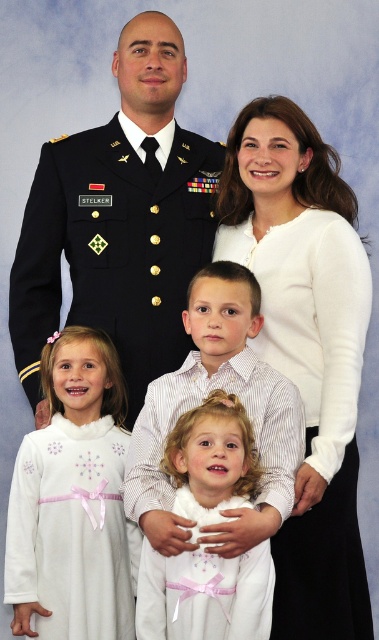
Question: Which object is closer to the camera taking this photo?

Choices:
 (A) white smooth sweater at upper center
 (B) white satin dress at lower center
 (C) dark blue uniform at upper left
 (D) white satin dress at lower left

Answer: (B)

Question: Is white satin dress at lower left further to camera compared to white satin dress at lower center?

Choices:
 (A) yes
 (B) no

Answer: (A)

Question: Which of the following is the farthest from the observer?

Choices:
 (A) white smooth sweater at upper center
 (B) white satin dress at lower center
 (C) white satin dress at lower left
 (D) dark blue uniform at upper left

Answer: (D)

Question: Is white satin dress at lower left bigger than white satin dress at lower center?

Choices:
 (A) yes
 (B) no

Answer: (A)

Question: Does dark blue uniform at upper left have a smaller size compared to white satin dress at lower left?

Choices:
 (A) no
 (B) yes

Answer: (A)

Question: Which of the following is the farthest from the observer?

Choices:
 (A) dark blue uniform at upper left
 (B) white smooth sweater at upper center
 (C) white satin dress at lower left

Answer: (A)